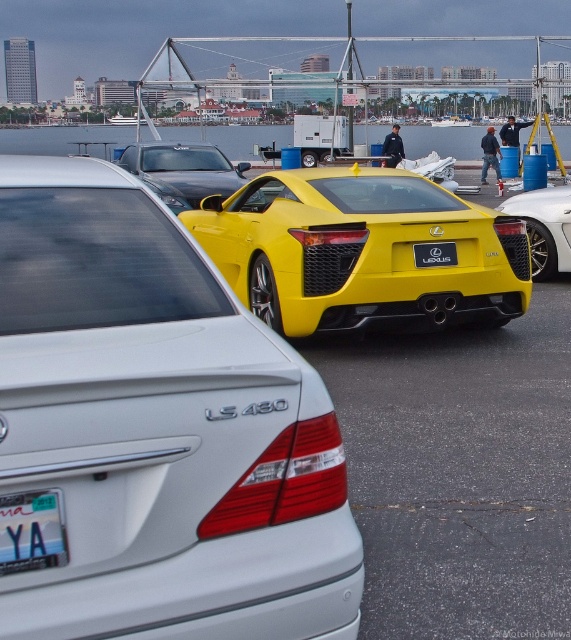
From the picture: You are standing in a parking lot and see the shiny black sedan at center and the white plastic license plate at lower left. Which object is closer to you?

The shiny black sedan at center is closer to you than the white plastic license plate at lower left.